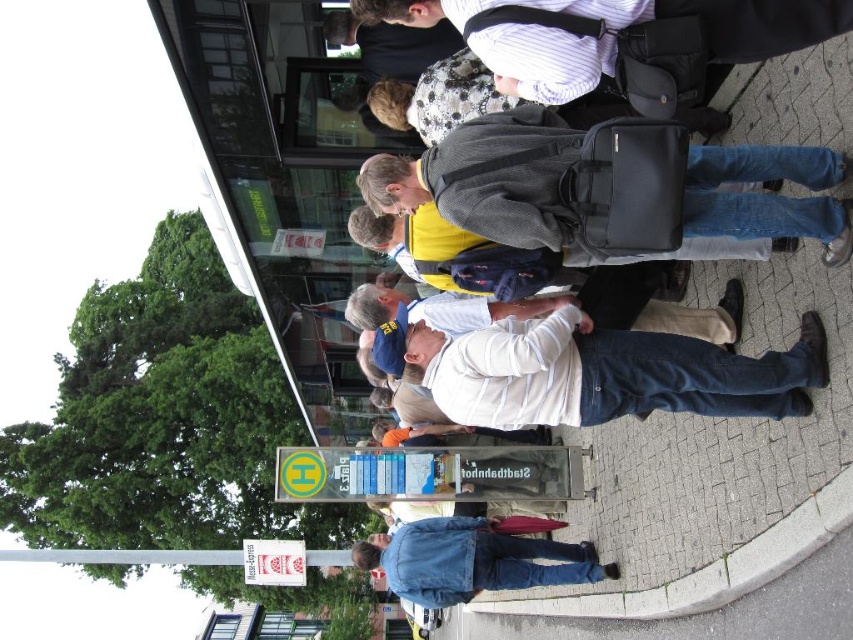
Question: Can you confirm if dark gray backpack at center is positioned below denim jacket at lower right?

Choices:
 (A) no
 (B) yes

Answer: (A)

Question: Does dark gray backpack at center have a lesser width compared to denim jacket at lower right?

Choices:
 (A) no
 (B) yes

Answer: (B)

Question: Which point is farther to the camera?

Choices:
 (A) dark gray backpack at center
 (B) denim jacket at lower right

Answer: (B)

Question: Observing the image, what is the correct spatial positioning of dark gray backpack at center in reference to denim jacket at lower right?

Choices:
 (A) left
 (B) right

Answer: (B)